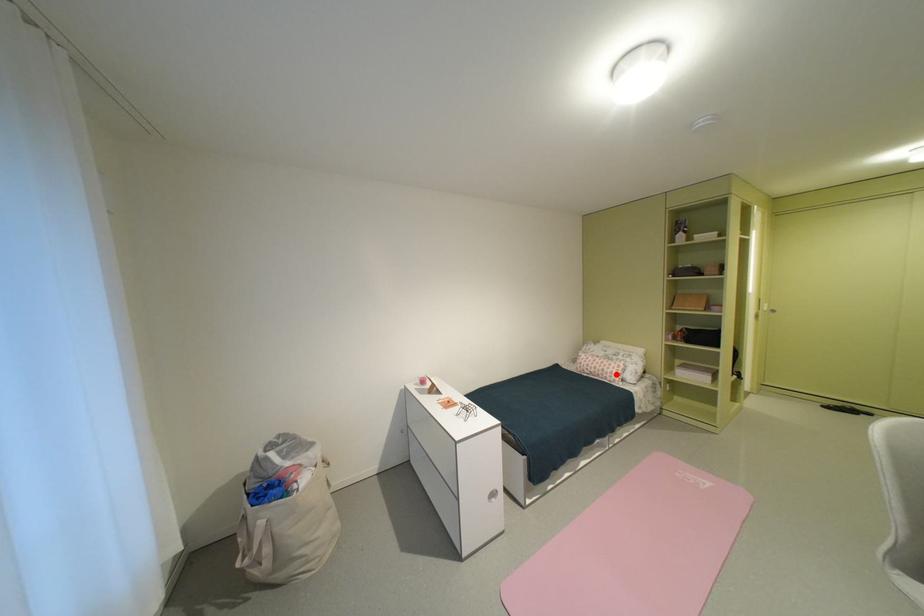
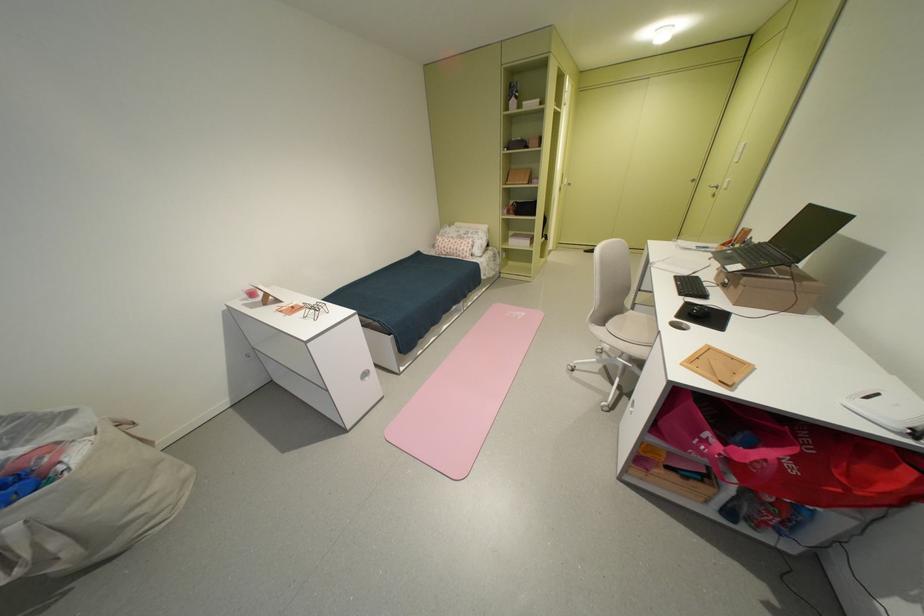
Question: I am providing you with two images of the same scene from different viewpoints. Given a red point in image1, look at the same physical point in image2. Is it:

Choices:
 (A) Closer to the viewpoint
 (B) Farther from the viewpoint

Answer: (A)